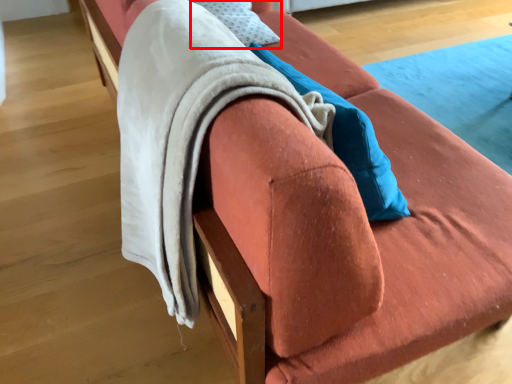
Question: From the image, what is the correct spatial relationship of pillow (annotated by the red box) in relation to blanket?

Choices:
 (A) right
 (B) left

Answer: (A)